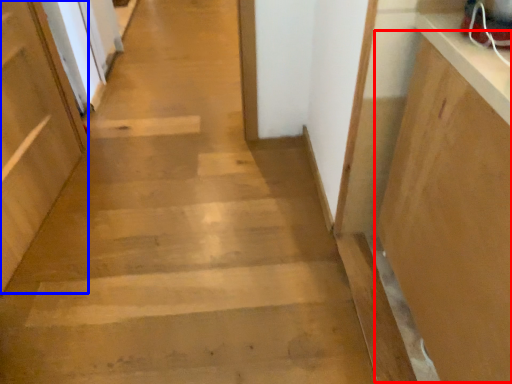
Question: Which object appears farthest to the camera in this image, cabinetry (highlighted by a red box) or door (highlighted by a blue box)?

Choices:
 (A) cabinetry
 (B) door

Answer: (B)